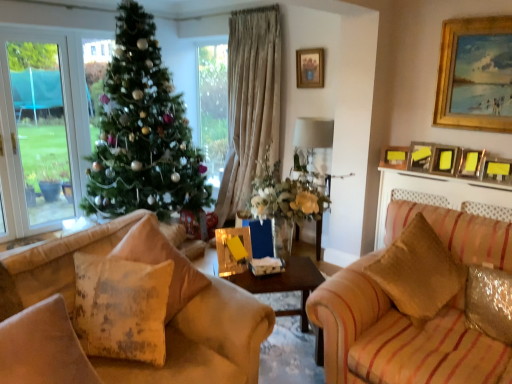
Question: Is point (417, 158) positioned closer to the camera than point (436, 153)?

Choices:
 (A) farther
 (B) closer

Answer: (A)

Question: Looking at the image, does metallic silver picture frame at upper right, marked as the 3th picture frame in a left-to-right arrangement, seem bigger or smaller compared to yellow matte picture frame at upper right, which is counted as the fourth picture frame, starting from the left?

Choices:
 (A) big
 (B) small

Answer: (B)

Question: Which object is the farthest from the fluffy beige pillow at center, the 3th pillow positioned from the left?

Choices:
 (A) yellow matte picture frame at upper right, which is counted as the fourth picture frame, starting from the left
 (B) green matte christmas tree at center
 (C) gold wooden picture frame at upper right, which appears as the second picture frame when viewed from the right
 (D) wooden table at center
 (E) matte gold picture frame at upper right, placed as the sixth picture frame when sorted from right to left

Answer: (C)

Question: Which of these objects is positioned farthest from the distressed fabric pillow at lower left, placed as the first pillow when sorted from left to right?

Choices:
 (A) gold-framed picture at upper center, the 7th picture frame in the right-to-left sequence
 (B) fluffy beige pillow at center, the 3th pillow positioned from the left
 (C) metallic gold picture frame at upper right, positioned as the seventh picture frame in left-to-right order
 (D) metallic gold picture frame at upper right, acting as the fifth picture frame starting from the left
 (E) metallic silver picture frame at upper right, acting as the fifth picture frame starting from the right

Answer: (A)